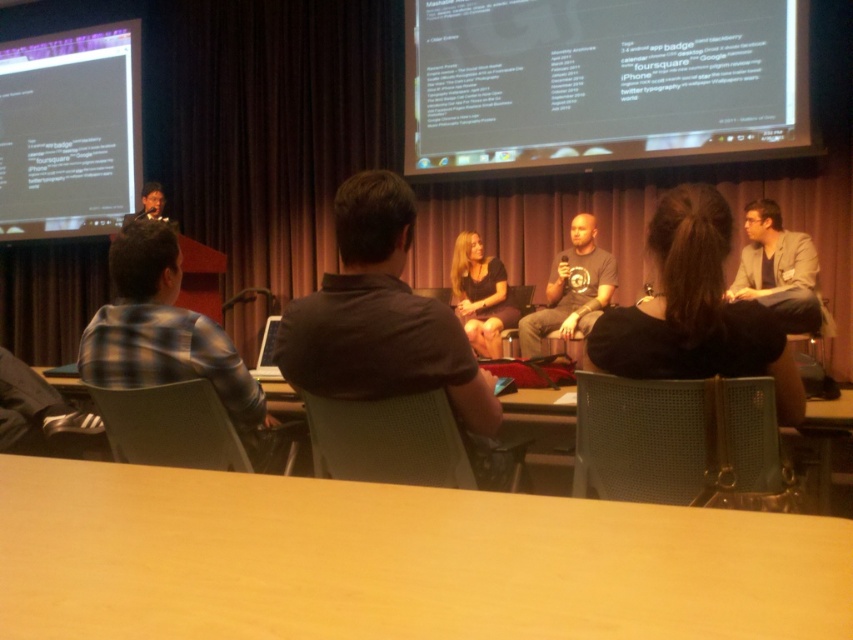
Is plaid shirt at left behind matte black glasses at left?

No, plaid shirt at left is in front of matte black glasses at left.

Is point (144, 292) farther from camera compared to point (137, 218)?

No, it is not.

Is point (117, 282) closer to viewer compared to point (125, 220)?

That is True.

Find the location of a particular element. plaid shirt at left is located at coordinates (167, 337).

Does dark brown shirt at center have a lesser height compared to brown wood table at lower center?

No.

I want to click on dark brown shirt at center, so click(x=386, y=324).

Identify the location of matte black screen at upper left. (68, 131).

Who is taller, matte black screen at upper left or matte gray blazer at right?

matte black screen at upper left is taller.

Which is in front, point (83, 148) or point (753, 218)?

Point (753, 218) is more forward.

Locate an element on the screen. This screenshot has width=853, height=640. matte black screen at upper left is located at coordinates (68, 131).